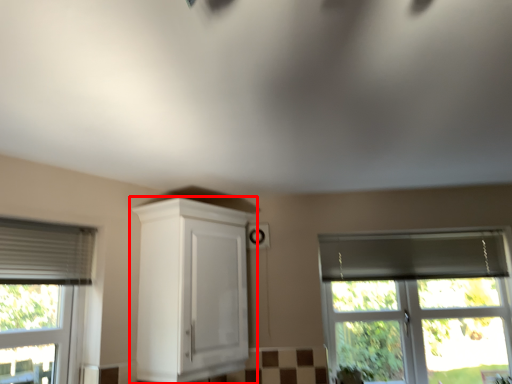
Question: From the image's perspective, what is the correct spatial positioning of cabinetry (annotated by the red box) in reference to window?

Choices:
 (A) above
 (B) below

Answer: (A)